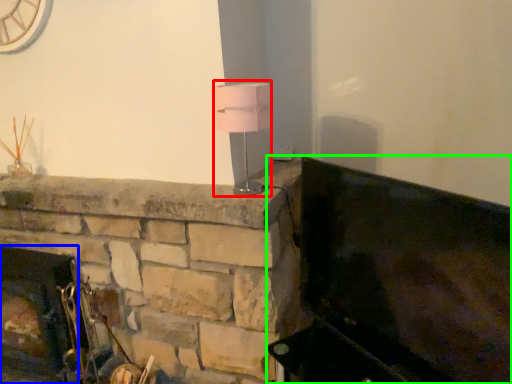
Question: Considering the real-world distances, which object is farthest from table lamp (highlighted by a red box)? fireplace (highlighted by a blue box) or furniture (highlighted by a green box)?

Choices:
 (A) fireplace
 (B) furniture

Answer: (A)